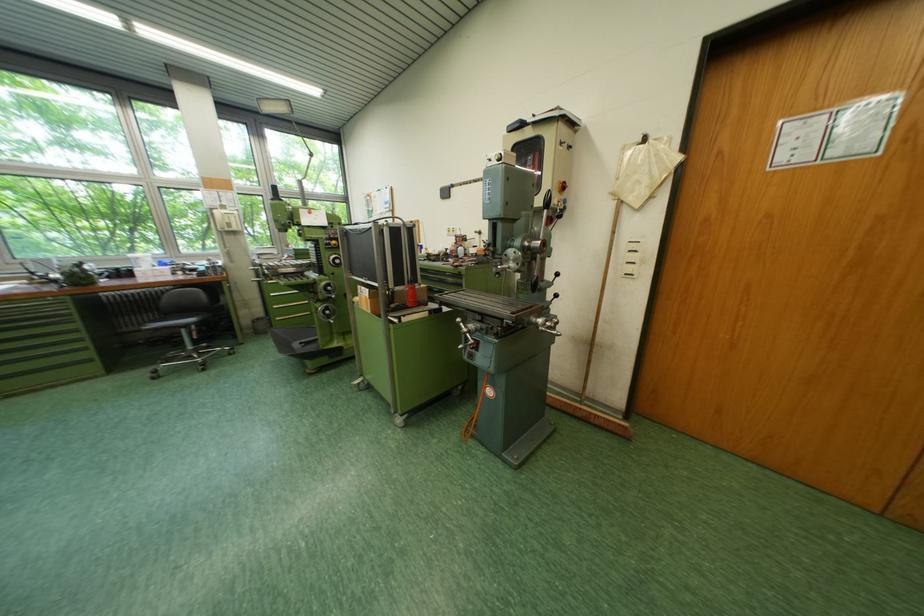
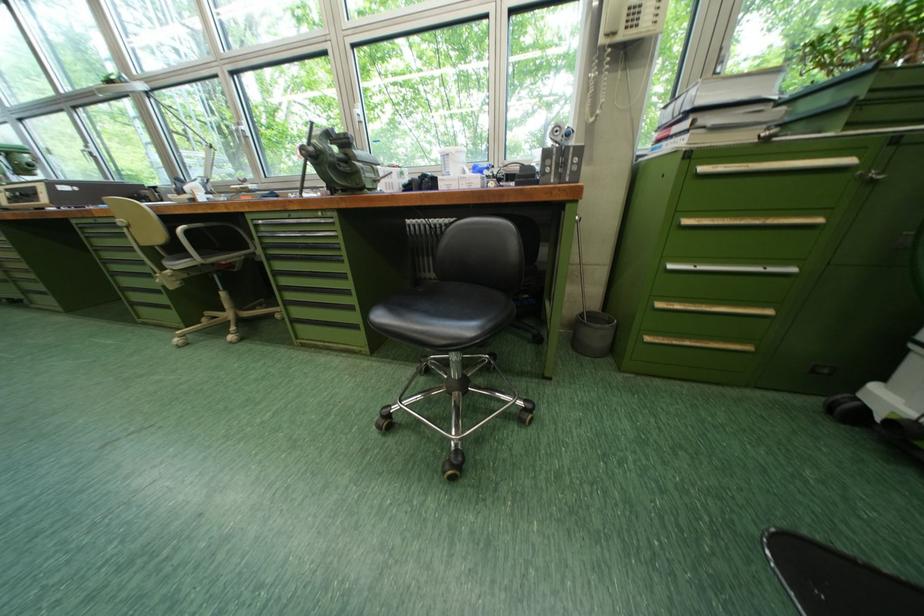
Find the pixel in the second image that matches the point at 262,322 in the first image.

(589, 315)